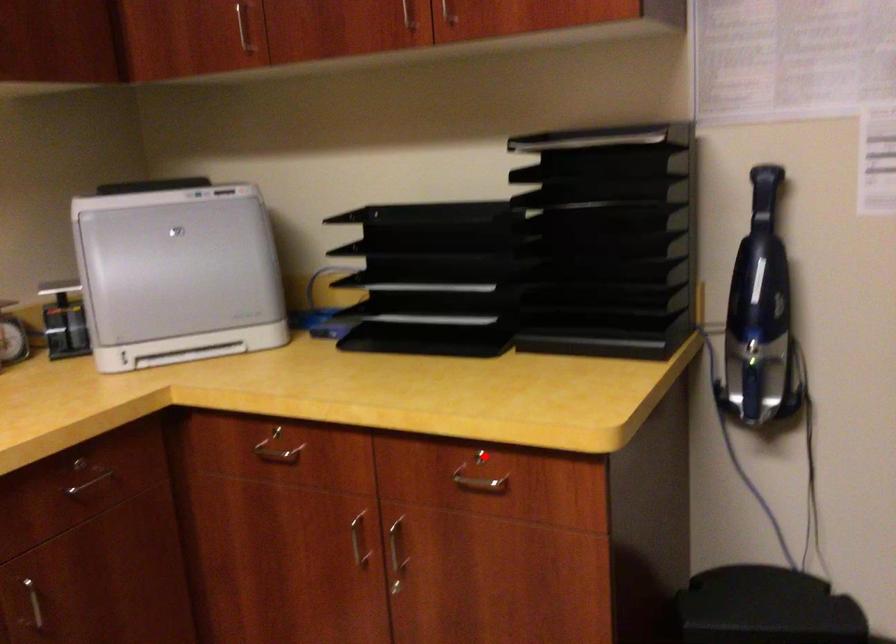
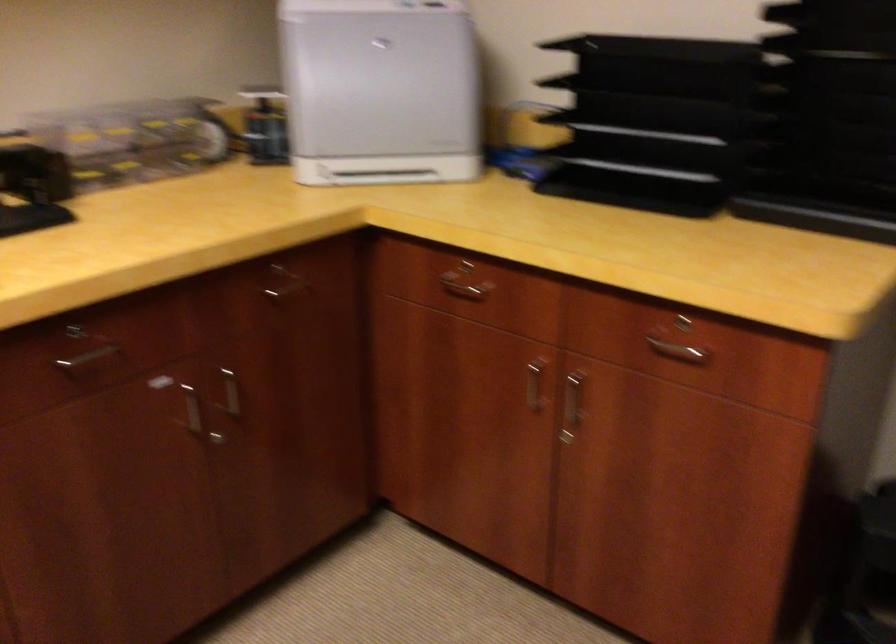
In the second image, find the point that corresponds to the highlighted location in the first image.

(686, 321)